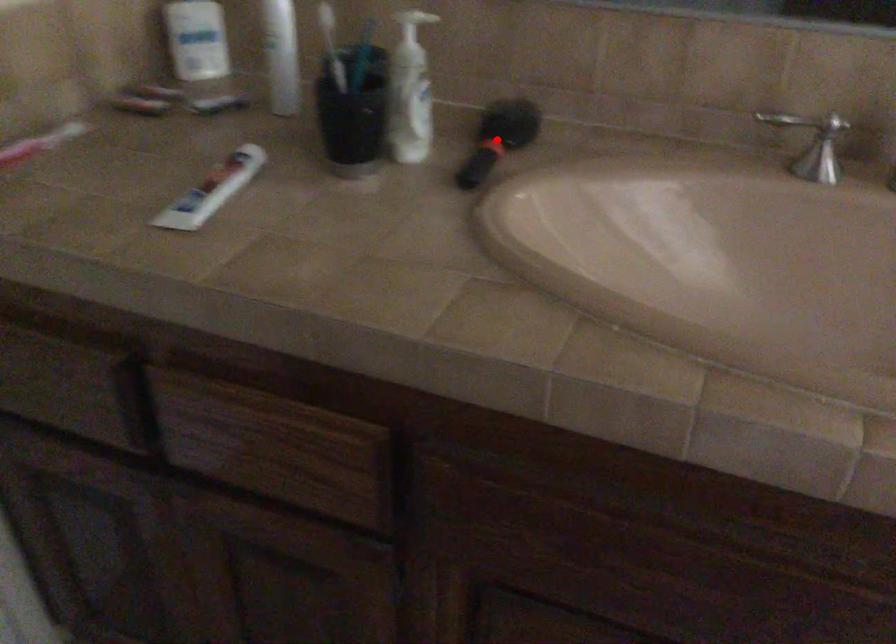
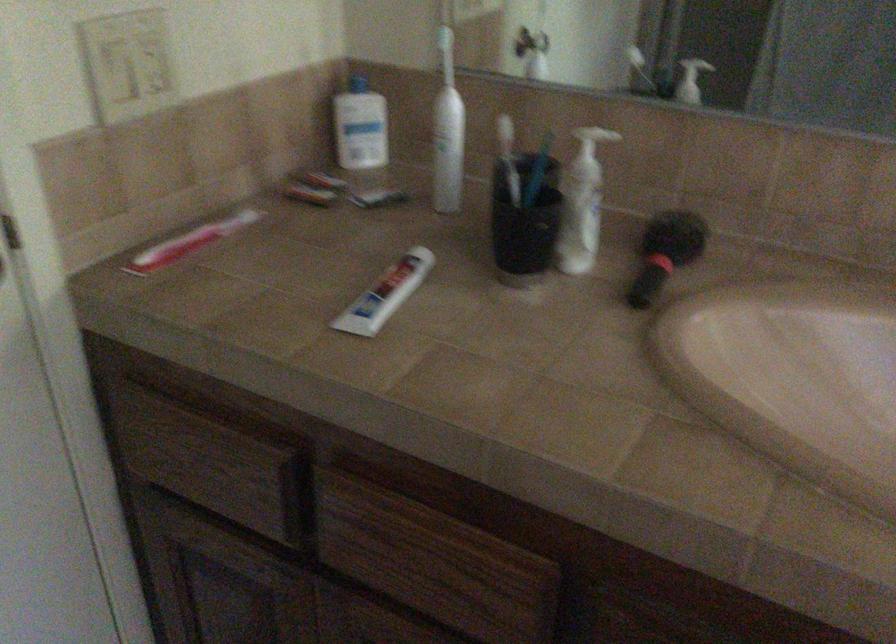
Find the pixel in the second image that matches the highlighted location in the first image.

(666, 252)